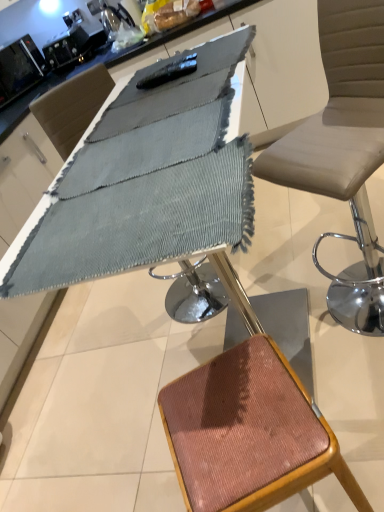
Question: Can you confirm if rustic wood stool at lower right is positioned to the left of textured gray fabric at center?

Choices:
 (A) yes
 (B) no

Answer: (B)

Question: Is rustic wood stool at lower right bigger than textured gray fabric at center?

Choices:
 (A) no
 (B) yes

Answer: (B)

Question: Is rustic wood stool at lower right looking in the opposite direction of textured gray fabric at center?

Choices:
 (A) no
 (B) yes

Answer: (A)

Question: Is rustic wood stool at lower right closer to camera compared to textured gray fabric at center?

Choices:
 (A) no
 (B) yes

Answer: (A)

Question: Is the position of rustic wood stool at lower right more distant than that of textured gray fabric at center?

Choices:
 (A) no
 (B) yes

Answer: (B)

Question: Considering the relative sizes of rustic wood stool at lower right and textured gray fabric at center in the image provided, is rustic wood stool at lower right taller than textured gray fabric at center?

Choices:
 (A) no
 (B) yes

Answer: (B)

Question: Is black glossy microwave at upper left inside textured gray fabric at center?

Choices:
 (A) no
 (B) yes

Answer: (A)

Question: Is textured gray fabric at center closer to camera compared to black glossy microwave at upper left?

Choices:
 (A) no
 (B) yes

Answer: (B)

Question: Is textured gray fabric at center far away from black glossy microwave at upper left?

Choices:
 (A) yes
 (B) no

Answer: (A)

Question: From the image's perspective, is textured gray fabric at center on black glossy microwave at upper left?

Choices:
 (A) no
 (B) yes

Answer: (A)

Question: Is textured gray fabric at center looking in the opposite direction of black glossy microwave at upper left?

Choices:
 (A) yes
 (B) no

Answer: (B)

Question: From a real-world perspective, is textured gray fabric at center beneath black glossy microwave at upper left?

Choices:
 (A) no
 (B) yes

Answer: (B)

Question: From the image's perspective, is black glossy microwave at upper left on top of textured gray fabric at center?

Choices:
 (A) yes
 (B) no

Answer: (A)